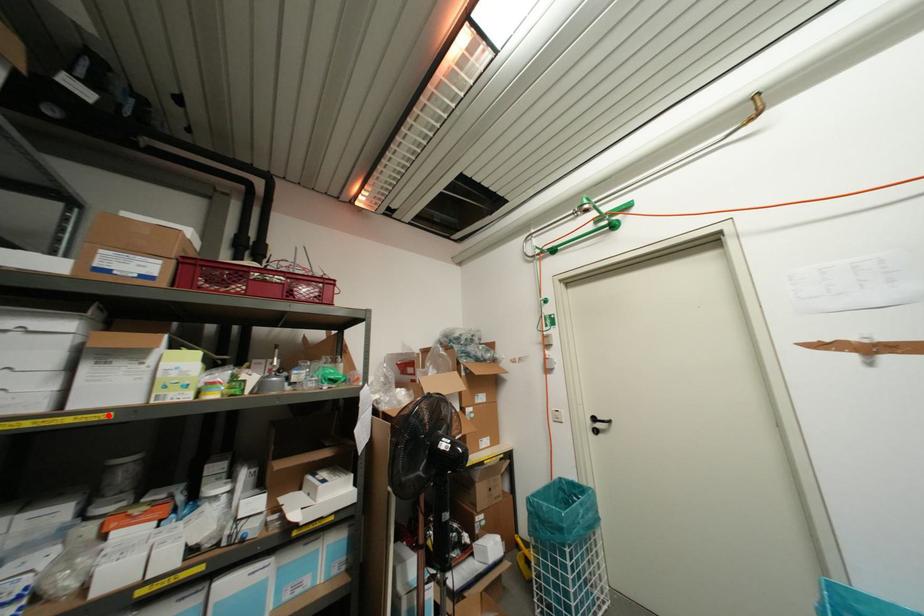
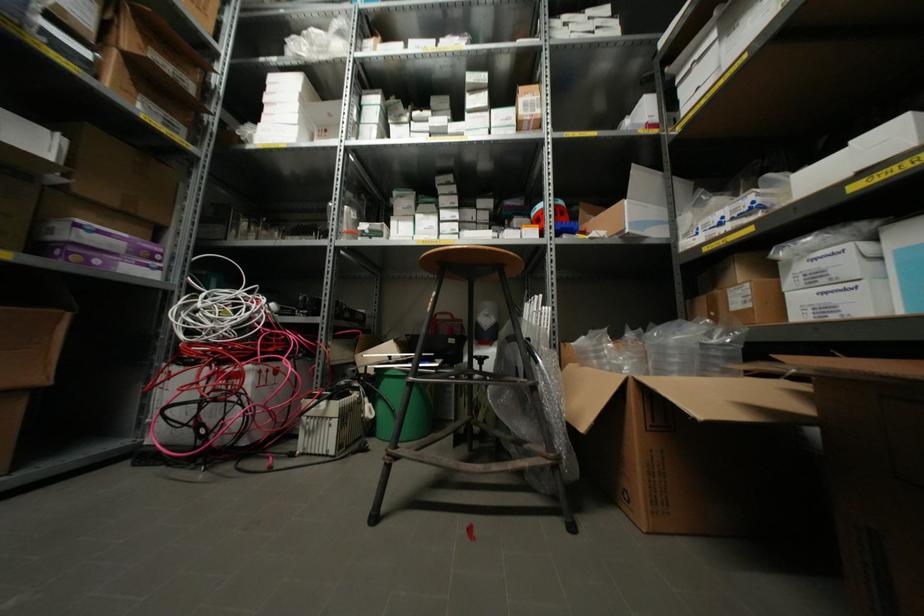
Question: I am providing you with two images of the same scene from different viewpoints. A red point is marked on the first image. At the location where the point appears in image 1, is it still visible in image 2?

Choices:
 (A) Yes
 (B) No

Answer: (A)